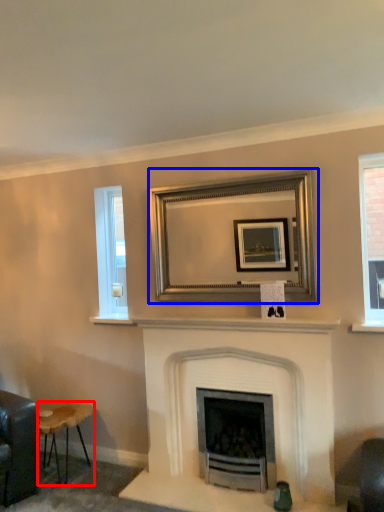
Question: Which object is closer to the camera taking this photo, stool (highlighted by a red box) or picture frame (highlighted by a blue box)?

Choices:
 (A) stool
 (B) picture frame

Answer: (B)